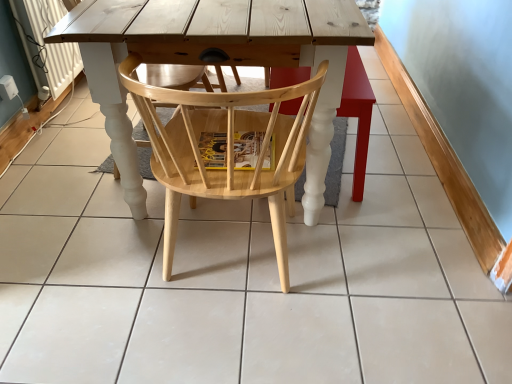
Locate an element on the screen. The height and width of the screenshot is (384, 512). free location in front of wooden chair at center is located at coordinates tap(367, 238).